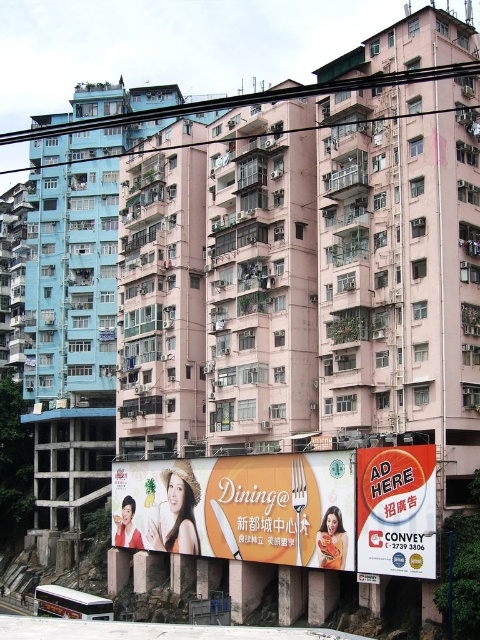
The height and width of the screenshot is (640, 480). What do you see at coordinates (240, 508) in the screenshot?
I see `orange glossy billboard at lower center` at bounding box center [240, 508].

Does orange glossy billboard at lower center have a greater height compared to orange glossy billboard at center?

Indeed, orange glossy billboard at lower center has a greater height compared to orange glossy billboard at center.

The image size is (480, 640). Describe the element at coordinates (240, 508) in the screenshot. I see `orange glossy billboard at lower center` at that location.

Identify the location of orange glossy billboard at lower center. (240, 508).